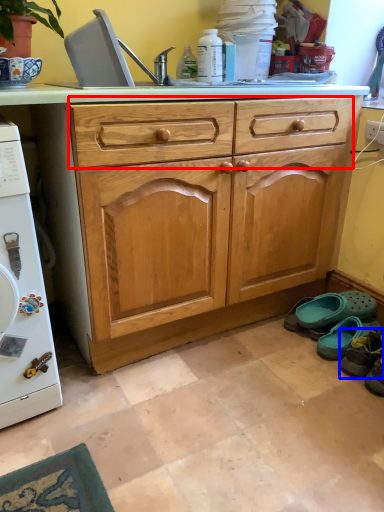
Question: Which object is further to the camera taking this photo, drawer (highlighted by a red box) or footwear (highlighted by a blue box)?

Choices:
 (A) drawer
 (B) footwear

Answer: (B)